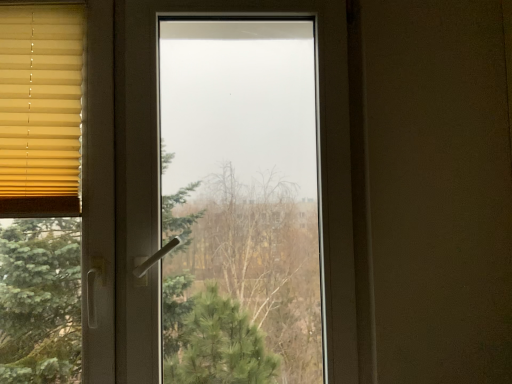
Question: Should I look upward or downward to see yellow fabric blinds at left?

Choices:
 (A) up
 (B) down

Answer: (A)

Question: Considering the relative sizes of yellow fabric blinds at left and transparent glass window at center in the image provided, is yellow fabric blinds at left thinner than transparent glass window at center?

Choices:
 (A) no
 (B) yes

Answer: (B)

Question: Is yellow fabric blinds at left not close to transparent glass window at center?

Choices:
 (A) yes
 (B) no

Answer: (B)

Question: Is yellow fabric blinds at left further to camera compared to transparent glass window at center?

Choices:
 (A) no
 (B) yes

Answer: (B)

Question: From the image's perspective, is yellow fabric blinds at left beneath transparent glass window at center?

Choices:
 (A) no
 (B) yes

Answer: (A)

Question: Does yellow fabric blinds at left appear on the right side of transparent glass window at center?

Choices:
 (A) yes
 (B) no

Answer: (B)

Question: Is the depth of yellow fabric blinds at left less than that of transparent glass window at center?

Choices:
 (A) yes
 (B) no

Answer: (B)

Question: Does transparent glass window at center have a greater width compared to yellow fabric blinds at left?

Choices:
 (A) no
 (B) yes

Answer: (B)

Question: Does transparent glass window at center appear on the left side of yellow fabric blinds at left?

Choices:
 (A) no
 (B) yes

Answer: (A)

Question: From a real-world perspective, does transparent glass window at center stand above yellow fabric blinds at left?

Choices:
 (A) yes
 (B) no

Answer: (B)

Question: Is transparent glass window at center positioned before yellow fabric blinds at left?

Choices:
 (A) no
 (B) yes

Answer: (B)

Question: Would you say transparent glass window at center is a long distance from yellow fabric blinds at left?

Choices:
 (A) no
 (B) yes

Answer: (A)

Question: Is transparent glass window at center thinner than yellow fabric blinds at left?

Choices:
 (A) yes
 (B) no

Answer: (B)

Question: From a real-world perspective, relative to transparent glass window at center, is yellow fabric blinds at left vertically above or below?

Choices:
 (A) below
 (B) above

Answer: (B)